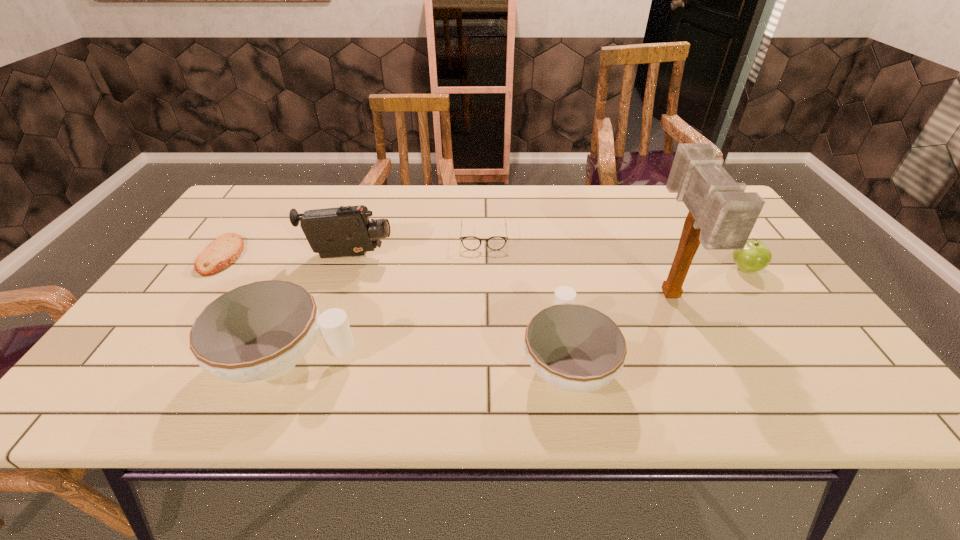
At what (x,y) coordinates should I click in order to perform the action: click on free area in between the rightmost object and the right chinaware. Please return your answer as a coordinate pair (x, y). Looking at the image, I should click on (656, 315).

The image size is (960, 540). Identify the location of empty location between the pita bread and the camcorder. (286, 256).

You are a GUI agent. You are given a task and a screenshot of the screen. Output one action in this format:
    pyautogui.click(x=<x>, y=<y>)
    Task: Click on the free spot between the camcorder and the third tallest object
    
    Given the screenshot: What is the action you would take?
    pyautogui.click(x=318, y=308)

The width and height of the screenshot is (960, 540). I want to click on free spot between the sixth object from left to right and the taller chinaware, so (x=479, y=328).

The width and height of the screenshot is (960, 540). I want to click on free space that is in between the second tallest object and the fourth object from right to left, so click(x=417, y=246).

Where is `empty space between the second object from right to left and the spectacles`? This screenshot has height=540, width=960. empty space between the second object from right to left and the spectacles is located at coordinates (577, 266).

The width and height of the screenshot is (960, 540). I want to click on object that is the second nearest to the camcorder, so click(x=495, y=243).

Locate which object is the second closest to the right chinaware. Please provide its 2D coordinates. Your answer should be formatted as a tuple, i.e. [(x, y)], where the tuple contains the x and y coordinates of a point satisfying the conditions above.

[(495, 243)]

Locate an element on the screen. This screenshot has height=540, width=960. blank area in the image that satisfies the following two spatial constraints: 1. on the front-facing side of the apple; 2. on the left side of the second tallest object is located at coordinates (345, 269).

Locate an element on the screen. Image resolution: width=960 pixels, height=540 pixels. free location that satisfies the following two spatial constraints: 1. through the lenses of the rightmost object; 2. on the right side of the spectacles is located at coordinates (484, 269).